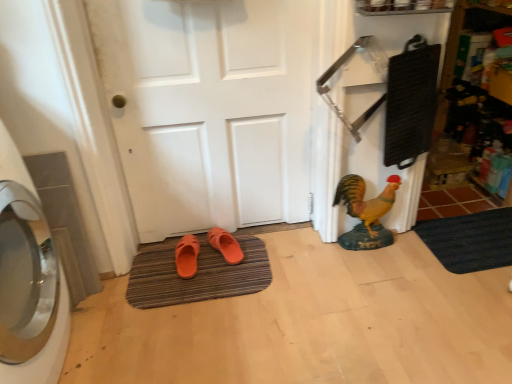
Where is `vacant space positioned to the left of black rubber bath mat at lower right, marked as the second bath mat in a left-to-right arrangement`? The width and height of the screenshot is (512, 384). vacant space positioned to the left of black rubber bath mat at lower right, marked as the second bath mat in a left-to-right arrangement is located at coordinates (403, 273).